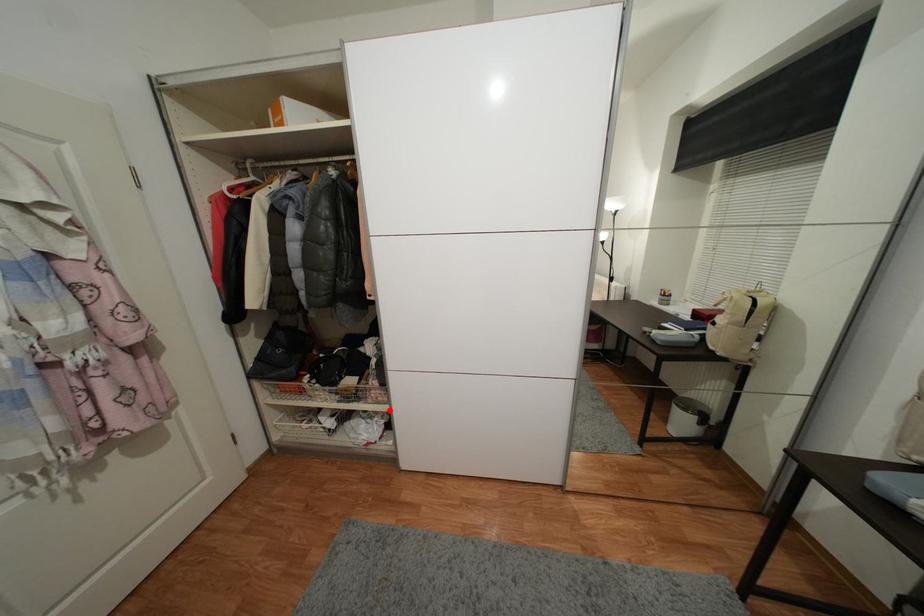
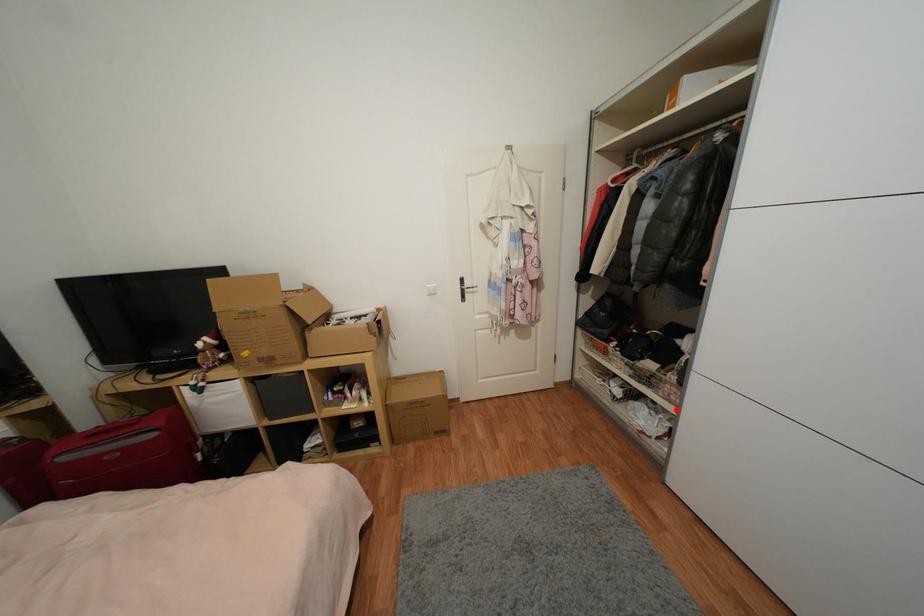
I am providing you with two images of the same scene from different viewpoints. A red point is marked on the first image and another point is marked on the second image. Do the highlighted points in image1 and image2 indicate the same real-world spot?

Yes